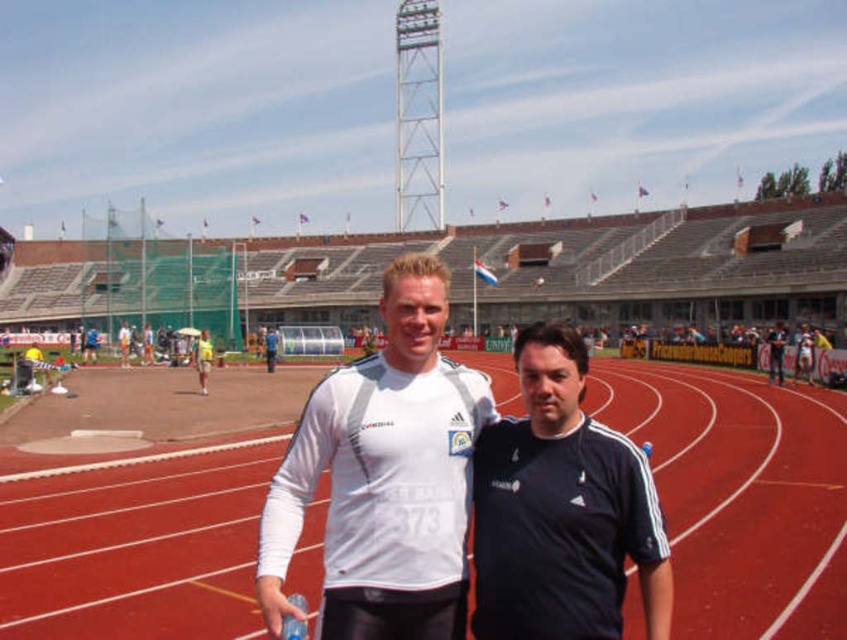
Question: Does black matte shirt at center appear on the left side of yellow fabric shorts at center?

Choices:
 (A) yes
 (B) no

Answer: (B)

Question: Which object is closer to the camera taking this photo?

Choices:
 (A) black matte shirt at center
 (B) red rubber track at center
 (C) white matte jersey at center

Answer: (C)

Question: Is black matte shirt at center in front of yellow fabric shorts at center?

Choices:
 (A) no
 (B) yes

Answer: (B)

Question: Which point is farther from the camera taking this photo?

Choices:
 (A) (363, 525)
 (B) (484, 474)

Answer: (B)

Question: Considering the real-world distances, which object is closest to the black matte shirt at center?

Choices:
 (A) yellow fabric shorts at center
 (B) white matte jersey at center

Answer: (B)

Question: Is the position of white matte jersey at center more distant than that of black matte shirt at center?

Choices:
 (A) yes
 (B) no

Answer: (B)